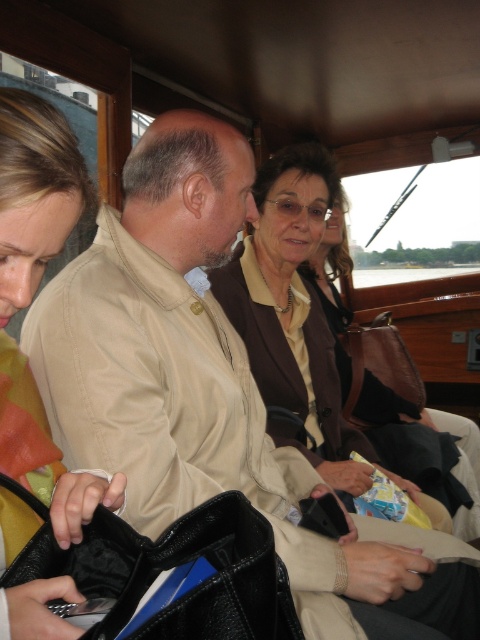
Question: Is matte yellow jacket at left thinner than black leather bag at lower left?

Choices:
 (A) no
 (B) yes

Answer: (B)

Question: Among these objects, which one is nearest to the camera?

Choices:
 (A) matte yellow jacket at left
 (B) black leather bag at lower left
 (C) brown leather jacket at center

Answer: (B)

Question: Can you confirm if black leather bag at lower left is positioned to the right of brown leather jacket at center?

Choices:
 (A) yes
 (B) no

Answer: (B)

Question: Which point is closer to the camera?

Choices:
 (A) black leather bag at lower left
 (B) brown leather jacket at center
 (C) matte yellow jacket at left

Answer: (A)

Question: Can you confirm if matte yellow jacket at left is positioned below brown leather jacket at center?

Choices:
 (A) yes
 (B) no

Answer: (A)

Question: Among these objects, which one is nearest to the camera?

Choices:
 (A) matte yellow jacket at left
 (B) black leather bag at lower left

Answer: (B)